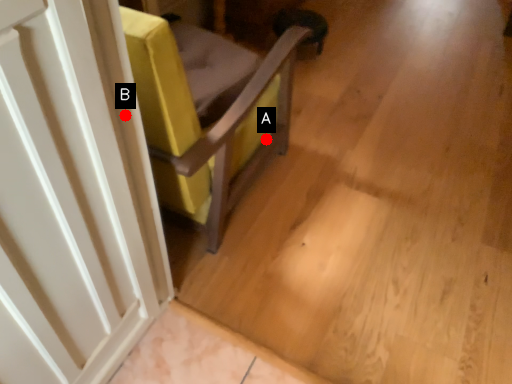
Question: Two points are circled on the image, labeled by A and B beside each circle. Which of the following is the farthest from the observer?

Choices:
 (A) A is further
 (B) B is further

Answer: (A)